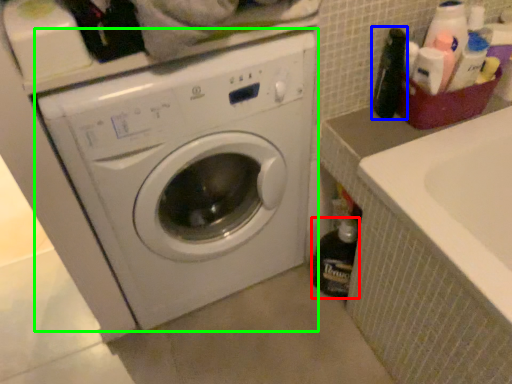
Question: Estimate the real-world distances between objects in this image. Which object is closer to bottle (highlighted by a red box), bottle (highlighted by a blue box) or washing machine (highlighted by a green box)?

Choices:
 (A) bottle
 (B) washing machine

Answer: (B)